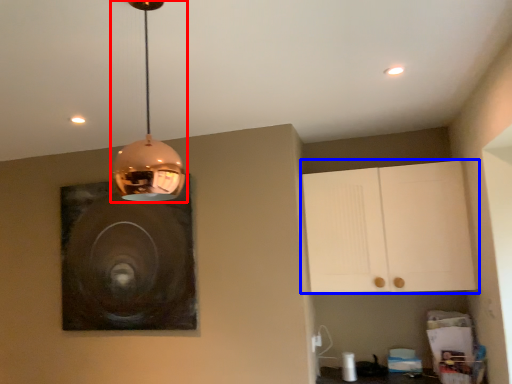
Question: Which object appears closest to the camera in this image, lamp (highlighted by a red box) or cabinetry (highlighted by a blue box)?

Choices:
 (A) lamp
 (B) cabinetry

Answer: (A)